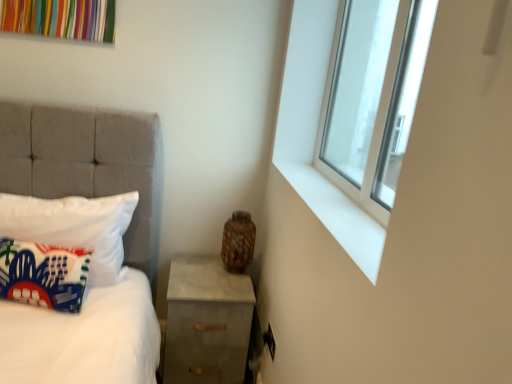
Question: Does printed fabric pillow at left, the second pillow when ordered from back to front, lie behind white smooth window sill at upper right?

Choices:
 (A) no
 (B) yes

Answer: (B)

Question: Can you confirm if printed fabric pillow at left, which is the 1th pillow in front-to-back order, is positioned to the left of white smooth window sill at upper right?

Choices:
 (A) no
 (B) yes

Answer: (B)

Question: Does printed fabric pillow at left, the second pillow when ordered from back to front, have a larger size compared to white smooth window sill at upper right?

Choices:
 (A) yes
 (B) no

Answer: (A)

Question: Does printed fabric pillow at left, the second pillow when ordered from back to front, turn towards white smooth window sill at upper right?

Choices:
 (A) yes
 (B) no

Answer: (B)

Question: Considering the relative sizes of printed fabric pillow at left, the second pillow when ordered from back to front, and white smooth window sill at upper right in the image provided, is printed fabric pillow at left, the second pillow when ordered from back to front, wider than white smooth window sill at upper right?

Choices:
 (A) no
 (B) yes

Answer: (A)

Question: Would you say white smooth window sill at upper right is part of printed fabric pillow at left, the second pillow when ordered from back to front,'s contents?

Choices:
 (A) yes
 (B) no

Answer: (B)

Question: Considering the relative sizes of printed fabric pillow at left, the second pillow when ordered from back to front, and clear glass window at upper right in the image provided, is printed fabric pillow at left, the second pillow when ordered from back to front, bigger than clear glass window at upper right?

Choices:
 (A) no
 (B) yes

Answer: (A)

Question: From a real-world perspective, does printed fabric pillow at left, which is the 1th pillow in front-to-back order, stand above clear glass window at upper right?

Choices:
 (A) no
 (B) yes

Answer: (A)

Question: Does printed fabric pillow at left, which is the 1th pillow in front-to-back order, have a smaller size compared to clear glass window at upper right?

Choices:
 (A) yes
 (B) no

Answer: (A)

Question: Is printed fabric pillow at left, the second pillow when ordered from back to front, wider than clear glass window at upper right?

Choices:
 (A) no
 (B) yes

Answer: (B)

Question: Considering the relative sizes of printed fabric pillow at left, which is the 1th pillow in front-to-back order, and clear glass window at upper right in the image provided, is printed fabric pillow at left, which is the 1th pillow in front-to-back order, thinner than clear glass window at upper right?

Choices:
 (A) yes
 (B) no

Answer: (B)

Question: Considering the relative sizes of printed fabric pillow at left, the second pillow when ordered from back to front, and clear glass window at upper right in the image provided, is printed fabric pillow at left, the second pillow when ordered from back to front, taller than clear glass window at upper right?

Choices:
 (A) no
 (B) yes

Answer: (A)

Question: Does clear glass window at upper right have a smaller size compared to concrete nightstand at lower right?

Choices:
 (A) yes
 (B) no

Answer: (A)